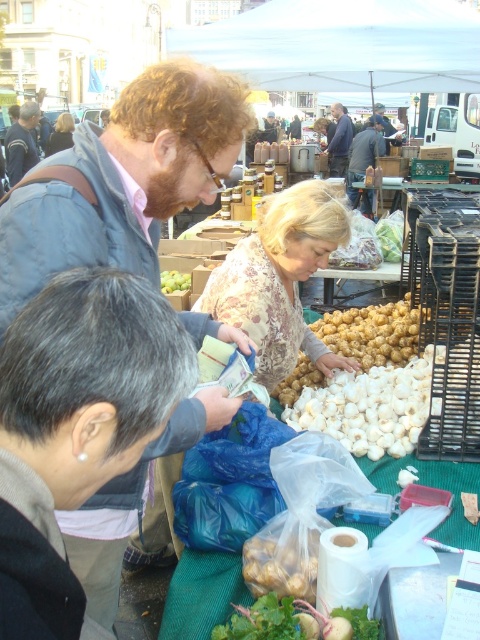
Question: Estimate the real-world distances between objects in this image. Which object is closer to the green leafy vegetable at center?

Choices:
 (A) white matte garlic at center
 (B) matte brown jacket at upper left
 (C) dark blue jeans at center

Answer: (A)

Question: Which of these objects is positioned farthest from the dark blue jeans at center?

Choices:
 (A) floral-patterned fabric at center
 (B) matte brown jacket at upper left
 (C) green leafy vegetable at center
 (D) fluffy white hair at upper center

Answer: (C)

Question: Can you confirm if white matte garlic at center is wider than matte brown jacket at upper left?

Choices:
 (A) no
 (B) yes

Answer: (A)

Question: Can you confirm if white fabric canopy at upper center is thinner than fluffy white hair at upper center?

Choices:
 (A) yes
 (B) no

Answer: (B)

Question: Based on their relative distances, which object is nearer to the floral-patterned fabric at center?

Choices:
 (A) green leafy vegetable at center
 (B) green matte garlic at center
 (C) matte brown jacket at upper left
 (D) white fabric canopy at upper center

Answer: (B)

Question: Is white matte garlic at center above matte brown jacket at center?

Choices:
 (A) yes
 (B) no

Answer: (B)